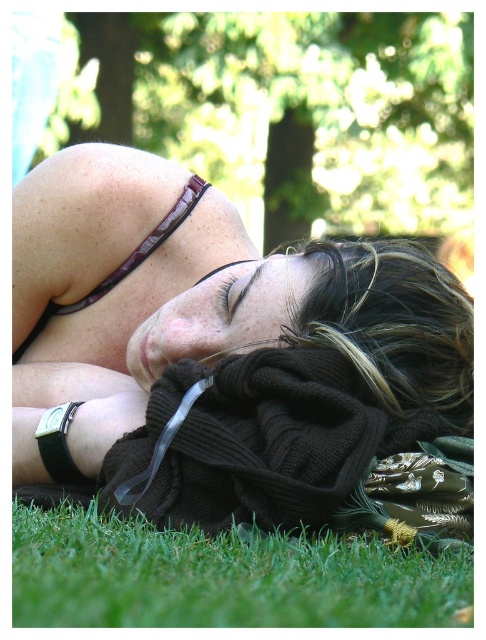
Does matte black sweater at center appear on the left side of green soft grass at lower left?

Indeed, matte black sweater at center is positioned on the left side of green soft grass at lower left.

How much distance is there between matte black sweater at center and green soft grass at lower left?

12.66 inches

Is point (432, 304) positioned before point (184, 576)?

No, (432, 304) is behind (184, 576).

Locate an element on the screen. Image resolution: width=486 pixels, height=640 pixels. matte black sweater at center is located at coordinates (194, 304).

Between point (122, 429) and point (440, 269), which one is positioned behind?

Positioned behind is point (440, 269).

Which is more to the left, matte black sweater at center or dark brown knit sweater at center?

Positioned to the left is matte black sweater at center.

Image resolution: width=486 pixels, height=640 pixels. What do you see at coordinates (194, 304) in the screenshot?
I see `matte black sweater at center` at bounding box center [194, 304].

Where is `matte black sweater at center`? This screenshot has width=486, height=640. matte black sweater at center is located at coordinates (194, 304).

Between green soft grass at lower left and dark brown knit sweater at center, which one is positioned higher?

dark brown knit sweater at center is above.

Can you confirm if green soft grass at lower left is thinner than dark brown knit sweater at center?

In fact, green soft grass at lower left might be wider than dark brown knit sweater at center.

Between point (87, 512) and point (372, 320), which one is positioned in front?

Point (87, 512) is more forward.

Find the location of `green soft grass at lower left`. green soft grass at lower left is located at coordinates (221, 577).